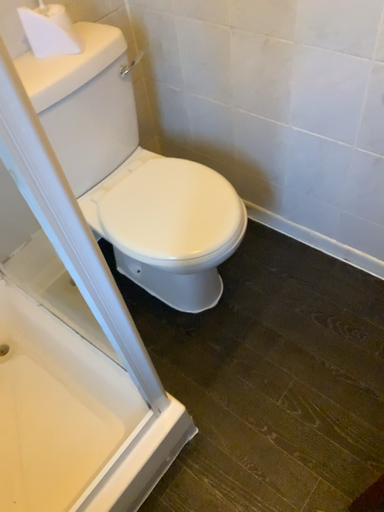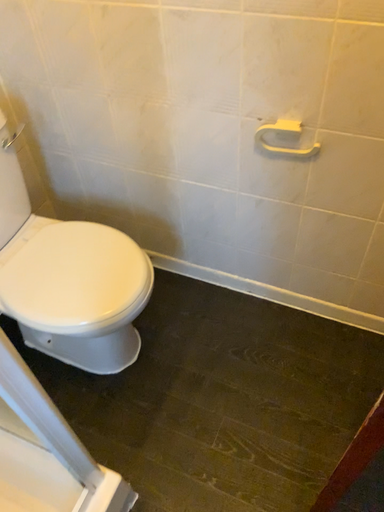
Question: How did the camera likely rotate when shooting the video?

Choices:
 (A) rotated left
 (B) rotated right

Answer: (B)